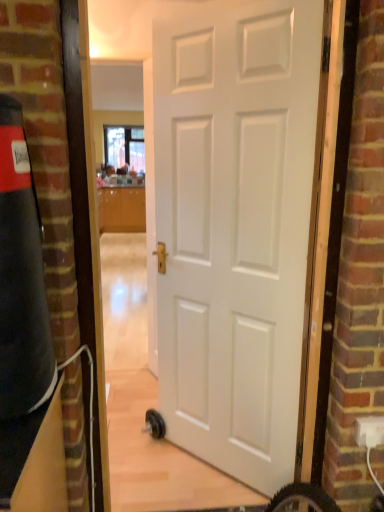
Measure the distance between white matte door at center and camera.

white matte door at center is 4.44 feet away from camera.

This screenshot has height=512, width=384. Describe the element at coordinates (369, 431) in the screenshot. I see `white plastic electric outlet at lower right` at that location.

The height and width of the screenshot is (512, 384). I want to click on white matte door at center, so click(x=235, y=229).

How many degrees apart are the facing directions of white plastic electric outlet at lower right and clear glass window at upper center?

There is a 1.18-degree angle between the facing directions of white plastic electric outlet at lower right and clear glass window at upper center.

Is clear glass window at upper center inside white plastic electric outlet at lower right?

No, clear glass window at upper center is located outside of white plastic electric outlet at lower right.

Does white plastic electric outlet at lower right lie in front of clear glass window at upper center?

Yes, the depth of white plastic electric outlet at lower right is less than that of clear glass window at upper center.

Is white plastic electric outlet at lower right next to clear glass window at upper center and touching it?

white plastic electric outlet at lower right and clear glass window at upper center are clearly separated.

Is white matte door at center inside the boundaries of clear glass window at upper center, or outside?

The correct answer is: outside.

From the image's perspective, is white matte door at center over clear glass window at upper center?

No, from the image's perspective, white matte door at center is not above clear glass window at upper center.

Considering the relative sizes of white matte door at center and clear glass window at upper center in the image provided, is white matte door at center thinner than clear glass window at upper center?

Incorrect, the width of white matte door at center is not less than that of clear glass window at upper center.

Is point (127, 143) closer or farther from the camera than point (268, 163)?

Point (127, 143) appears to be farther away from the viewer than point (268, 163).

From their relative heights in the image, would you say clear glass window at upper center is taller or shorter than white matte door at center?

In the image, clear glass window at upper center appears to be shorter than white matte door at center.

Where is `door in front of the clear glass window at upper center`? The image size is (384, 512). door in front of the clear glass window at upper center is located at coordinates (235, 229).

Is clear glass window at upper center far away from white matte door at center?

Yes.

Does point (216, 439) appear closer or farther from the camera than point (100, 188)?

Clearly, point (216, 439) is closer to the camera than point (100, 188).

From the image's perspective, between white matte door at center and glossy wood cabinetry at center, which one is located above?

glossy wood cabinetry at center appears higher in the image.

Which is more to the right, white matte door at center or glossy wood cabinetry at center?

white matte door at center is more to the right.

Considering the sizes of objects white matte door at center and glossy wood cabinetry at center in the image provided, who is bigger, white matte door at center or glossy wood cabinetry at center?

Bigger between the two is glossy wood cabinetry at center.

Considering the relative positions of white plastic electric outlet at lower right and white matte door at center in the image provided, is white plastic electric outlet at lower right to the left of white matte door at center from the viewer's perspective?

No, white plastic electric outlet at lower right is not to the left of white matte door at center.

Based on the photo, considering the sizes of objects white plastic electric outlet at lower right and white matte door at center in the image provided, who is wider, white plastic electric outlet at lower right or white matte door at center?

Wider between the two is white matte door at center.

From a real-world perspective, who is located higher, white plastic electric outlet at lower right or white matte door at center?

In real-world perspective, white matte door at center is above.

This screenshot has height=512, width=384. What are the coordinates of `electric outlet above the glossy wood cabinetry at center (from a real-world perspective)` in the screenshot? It's located at (369, 431).

Does white plastic electric outlet at lower right turn towards glossy wood cabinetry at center?

No, white plastic electric outlet at lower right is not oriented towards glossy wood cabinetry at center.

From the image's perspective, is white plastic electric outlet at lower right above or below glossy wood cabinetry at center?

From the image's perspective, white plastic electric outlet at lower right appears below glossy wood cabinetry at center.

From a real-world perspective, is white plastic electric outlet at lower right over glossy wood cabinetry at center?

Yes, from a real-world perspective, white plastic electric outlet at lower right is over glossy wood cabinetry at center

From a real-world perspective, which is physically above, glossy wood cabinetry at center or white plastic electric outlet at lower right?

white plastic electric outlet at lower right is physically above.

Looking at their sizes, would you say glossy wood cabinetry at center is wider or thinner than white plastic electric outlet at lower right?

glossy wood cabinetry at center is wider than white plastic electric outlet at lower right.

Between glossy wood cabinetry at center and white plastic electric outlet at lower right, which one appears on the right side from the viewer's perspective?

From the viewer's perspective, white plastic electric outlet at lower right appears more on the right side.

Is glossy wood cabinetry at center not inside white plastic electric outlet at lower right?

Absolutely, glossy wood cabinetry at center is external to white plastic electric outlet at lower right.

Find the location of a particular element. The height and width of the screenshot is (512, 384). window behind the white plastic electric outlet at lower right is located at coordinates (124, 147).

Find the location of a particular element. The height and width of the screenshot is (512, 384). window above the white matte door at center (from a real-world perspective) is located at coordinates point(124,147).

When comparing their distances from white matte door at center, does glossy wood cabinetry at center or white plastic electric outlet at lower right seem closer?

Among the two, white plastic electric outlet at lower right is located nearer to white matte door at center.

From the image, which object appears to be farther from white plastic electric outlet at lower right, clear glass window at upper center or white matte door at center?

clear glass window at upper center lies further to white plastic electric outlet at lower right than the other object.

Considering their positions, is white plastic electric outlet at lower right positioned further to glossy wood cabinetry at center than clear glass window at upper center?

Based on the image, white plastic electric outlet at lower right appears to be further to glossy wood cabinetry at center.

Based on their spatial positions, is clear glass window at upper center or glossy wood cabinetry at center further from white plastic electric outlet at lower right?

clear glass window at upper center is positioned further to the anchor white plastic electric outlet at lower right.

Based on the photo, considering their positions, is clear glass window at upper center positioned closer to glossy wood cabinetry at center than white matte door at center?

clear glass window at upper center lies closer to glossy wood cabinetry at center than the other object.

When comparing their distances from clear glass window at upper center, does white matte door at center or glossy wood cabinetry at center seem further?

The object further to clear glass window at upper center is white matte door at center.

From the image, which object appears to be nearer to white matte door at center, clear glass window at upper center or white plastic electric outlet at lower right?

Among the two, white plastic electric outlet at lower right is located nearer to white matte door at center.

Considering their positions, is white plastic electric outlet at lower right positioned further to white matte door at center than clear glass window at upper center?

clear glass window at upper center is further to white matte door at center.

This screenshot has height=512, width=384. What are the coordinates of `electric outlet located between white matte door at center and glossy wood cabinetry at center in the depth direction` in the screenshot? It's located at (369, 431).

Where is `cabinetry between white plastic electric outlet at lower right and clear glass window at upper center in the front-back direction`? The height and width of the screenshot is (512, 384). cabinetry between white plastic electric outlet at lower right and clear glass window at upper center in the front-back direction is located at coordinates (121, 209).

At what (x,y) coordinates should I click in order to perform the action: click on electric outlet between white matte door at center and clear glass window at upper center from front to back. Please return your answer as a coordinate pair (x, y). This screenshot has height=512, width=384. Looking at the image, I should click on (369, 431).

Locate an element on the screen. cabinetry located between white matte door at center and clear glass window at upper center in the depth direction is located at coordinates pos(121,209).